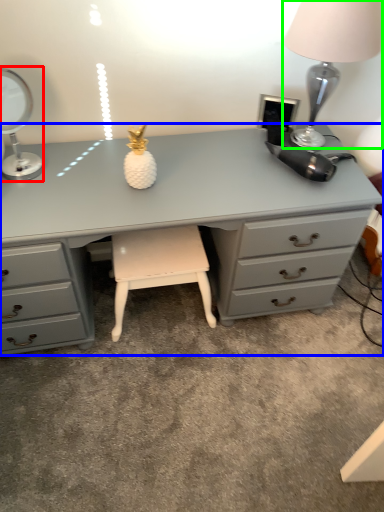
Question: Which object is positioned closest to table lamp (highlighted by a red box)? Select from desk (highlighted by a blue box) and table lamp (highlighted by a green box).

Choices:
 (A) desk
 (B) table lamp

Answer: (A)